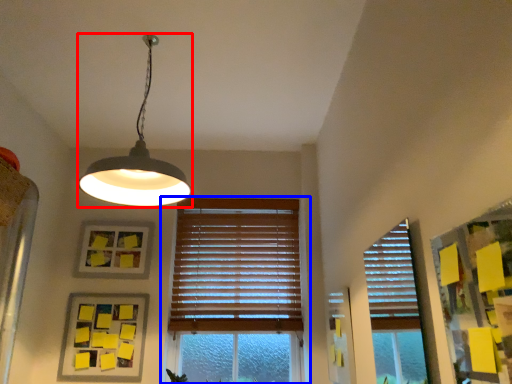
Question: Which of the following is the farthest to the observer, lamp (highlighted by a red box) or window (highlighted by a blue box)?

Choices:
 (A) lamp
 (B) window

Answer: (B)